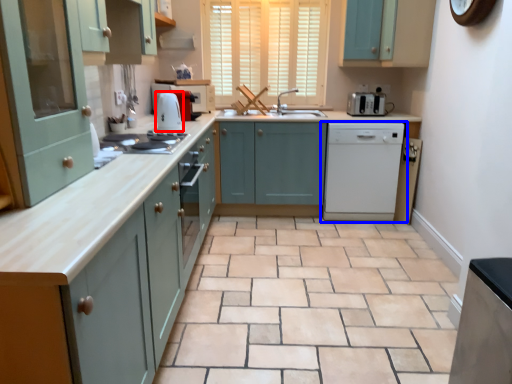
Question: Which point is closer to the camera, kitchen appliance (highlighted by a red box) or home appliance (highlighted by a blue box)?

Choices:
 (A) kitchen appliance
 (B) home appliance

Answer: (A)